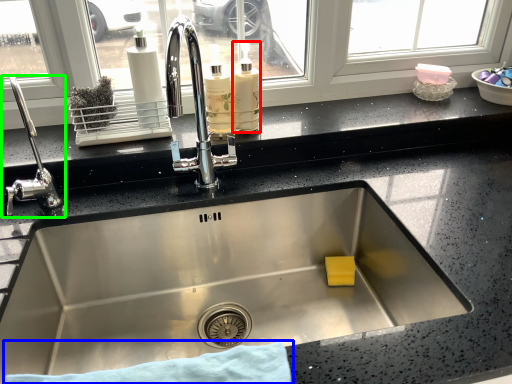
Question: Which object is the closest to the bottle (highlighted by a red box)? Choose among these: bath towel (highlighted by a blue box) or tap (highlighted by a green box).

Choices:
 (A) bath towel
 (B) tap

Answer: (B)